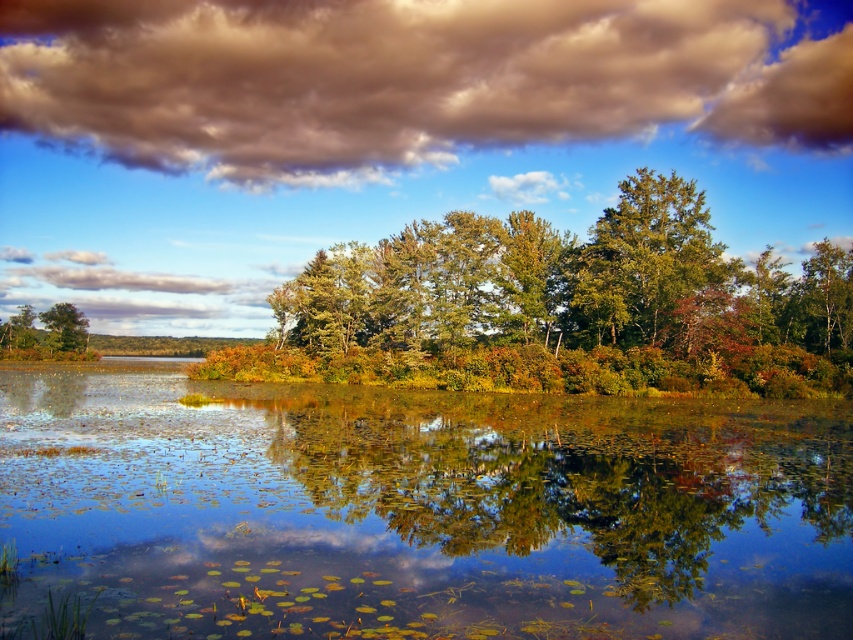
Based on the scene description, where are the green leafy trees at center located in the image?

The green leafy trees at center are located at point (567, 300).

You are standing at the edge of the lake and see two points marked in the scene. The first point is at coordinates point [563,522] and the second point is at point [619,29]. Which point is closer to you?

Point [563,522] is in front of point [619,29], so it is closer to you.

You are a hiker who wants to cross the lake using a small boat that can carry a maximum of 300 feet. You see the green matte tree at upper right and the green matte tree at left. Can you safely cross the lake between these two trees with your boat?

The distance between the green matte tree at upper right and the green matte tree at left is 315.66 feet, which exceeds the boat maximum capacity of 300 feet. Therefore, you cannot safely cross the lake between these two trees with your boat.